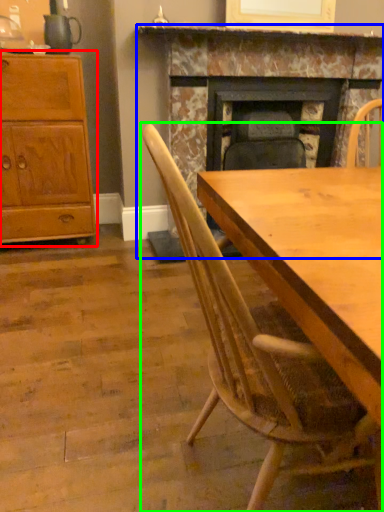
Question: Considering the real-world distances, which object is closest to cabinetry (highlighted by a red box)? fireplace (highlighted by a blue box) or chair (highlighted by a green box).

Choices:
 (A) fireplace
 (B) chair

Answer: (A)